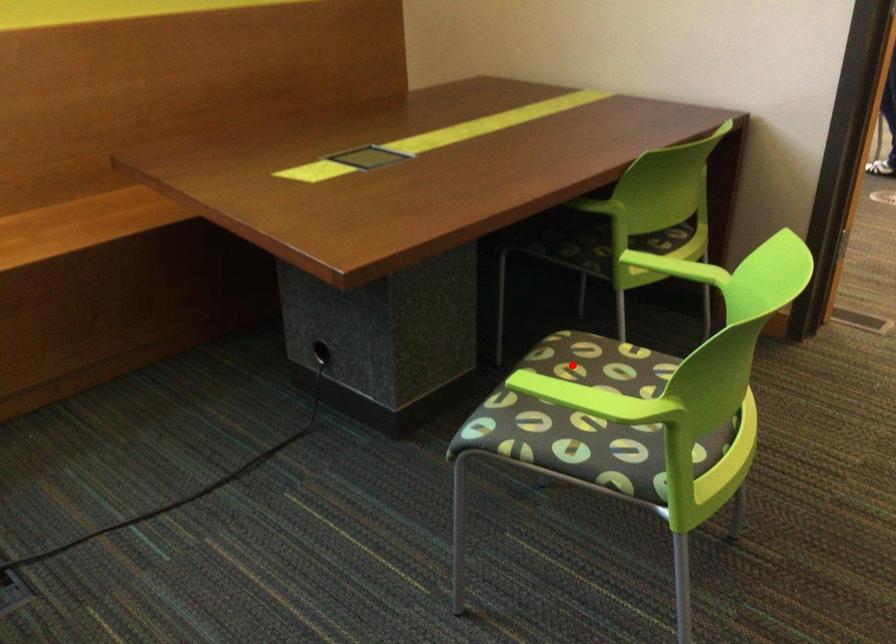
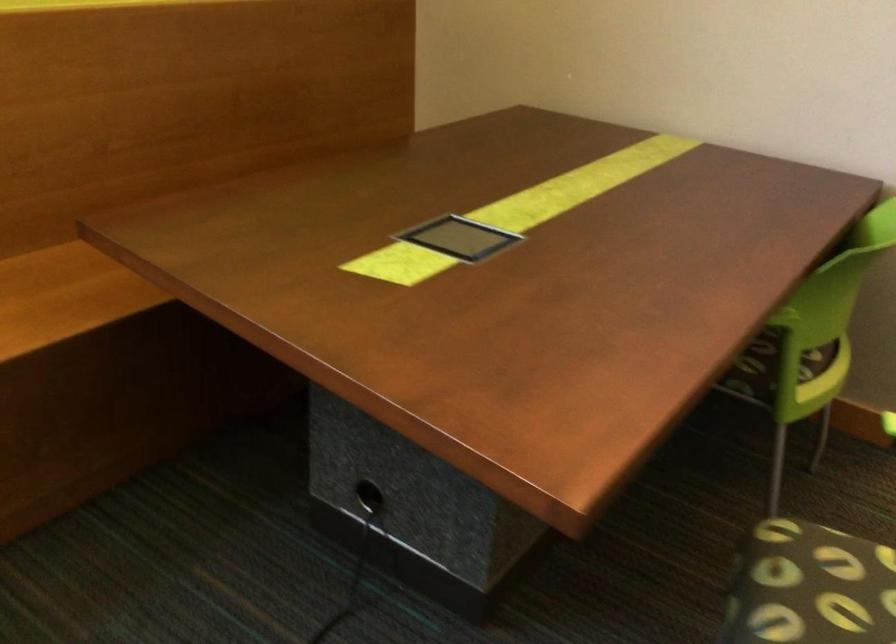
Question: I am providing you with two images of the same scene from different viewpoints. In image1, a red point is highlighted. Considering the same 3D point in image2, which of the following is correct?

Choices:
 (A) It is closer
 (B) It is farther

Answer: (A)